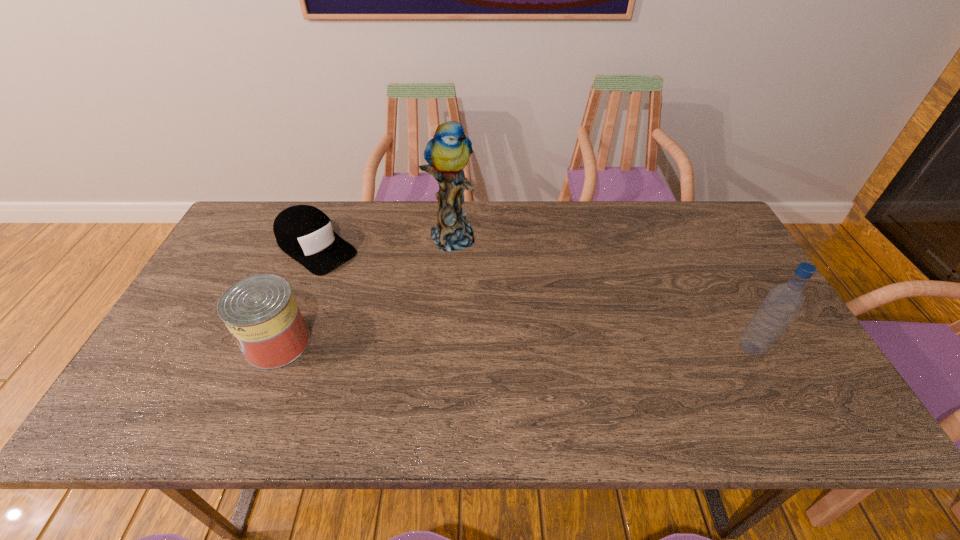
The height and width of the screenshot is (540, 960). In order to click on blank region between the tallest object and the can in this screenshot , I will do `click(364, 289)`.

This screenshot has width=960, height=540. I want to click on free area in between the shortest object and the rightmost object, so click(x=534, y=298).

At what (x,y) coordinates should I click in order to perform the action: click on vacant space in between the shortest object and the second shortest object. Please return your answer as a coordinate pair (x, y). Looking at the image, I should click on (297, 295).

You are a GUI agent. You are given a task and a screenshot of the screen. Output one action in this format:
    pyautogui.click(x=<x>, y=<y>)
    Task: Click on the free spot between the rightmost object and the cap
    Image resolution: width=960 pixels, height=540 pixels.
    Given the screenshot: What is the action you would take?
    pyautogui.click(x=534, y=298)

At what (x,y) coordinates should I click in order to perform the action: click on vacant area that lies between the rightmost object and the cap. Please return your answer as a coordinate pair (x, y). The width and height of the screenshot is (960, 540). Looking at the image, I should click on coord(534,298).

Select which object appears as the third closest to the tallest object. Please provide its 2D coordinates. Your answer should be formatted as a tuple, i.e. [(x, y)], where the tuple contains the x and y coordinates of a point satisfying the conditions above.

[(782, 303)]

Point out which object is positioned as the third nearest to the can. Please provide its 2D coordinates. Your answer should be formatted as a tuple, i.e. [(x, y)], where the tuple contains the x and y coordinates of a point satisfying the conditions above.

[(782, 303)]

Where is `free location that satisfies the following two spatial constraints: 1. on the front side of the water bottle; 2. on the right side of the tallest object`? free location that satisfies the following two spatial constraints: 1. on the front side of the water bottle; 2. on the right side of the tallest object is located at coordinates (443, 348).

At what (x,y) coordinates should I click in order to perform the action: click on free point that satisfies the following two spatial constraints: 1. on the front side of the rightmost object; 2. on the right side of the cap. Please return your answer as a coordinate pair (x, y). This screenshot has height=540, width=960. Looking at the image, I should click on (276, 348).

Find the location of `vacant space that satisfies the following two spatial constraints: 1. on the back side of the tallest object; 2. on the left side of the third tallest object`. vacant space that satisfies the following two spatial constraints: 1. on the back side of the tallest object; 2. on the left side of the third tallest object is located at coordinates (321, 235).